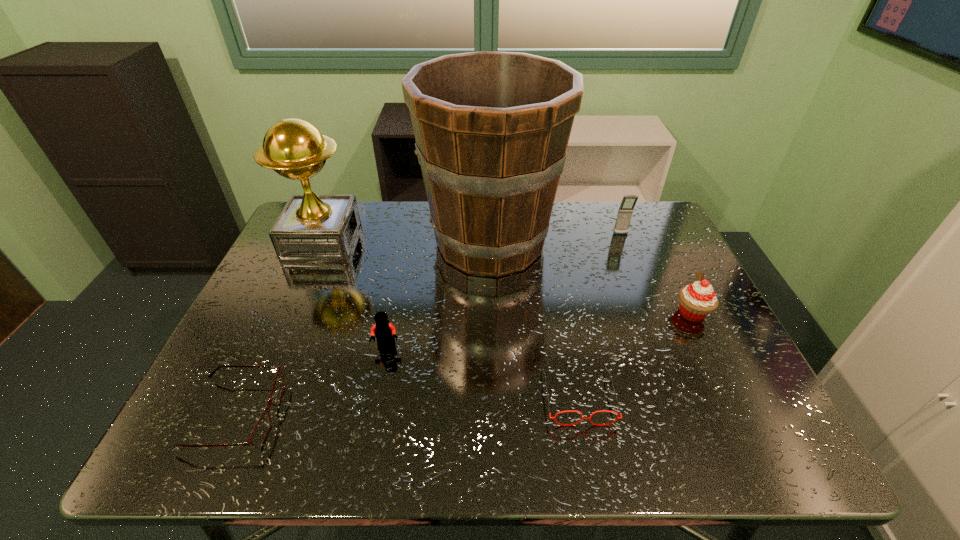
In the image, there is a desktop. Where is `free space at the far right corner`? free space at the far right corner is located at coordinates (625, 241).

Where is `vacant area that lies between the fifth tallest object and the tallest object`? This screenshot has width=960, height=540. vacant area that lies between the fifth tallest object and the tallest object is located at coordinates (439, 294).

This screenshot has width=960, height=540. Find the location of `free spot between the left spectacles and the third shortest object`. free spot between the left spectacles and the third shortest object is located at coordinates [x=311, y=381].

At what (x,y) coordinates should I click in order to perform the action: click on vacant area that lies between the second tallest object and the rightmost object. Please return your answer as a coordinate pair (x, y). Looking at the image, I should click on (507, 278).

Find the location of a particular element. vacant area between the right spectacles and the third shortest object is located at coordinates (483, 372).

Where is `vacant point located between the bucket and the sixth object from left to right`? vacant point located between the bucket and the sixth object from left to right is located at coordinates (556, 238).

Locate an element on the screen. vacant area that lies between the sixth shortest object and the tallest object is located at coordinates (406, 242).

What are the coordinates of `free space between the fifth shortest object and the right spectacles` in the screenshot? It's located at (600, 315).

At what (x,y) coordinates should I click in order to perform the action: click on blank region between the third shortest object and the tallest object. Please return your answer as a coordinate pair (x, y). Looking at the image, I should click on (439, 294).

Find the location of a particular element. The image size is (960, 540). free space between the cupcake and the third tallest object is located at coordinates (657, 274).